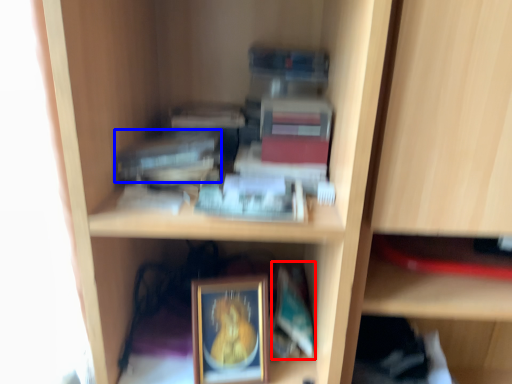
Question: Among these objects, which one is nearest to the camera, paperback book (highlighted by a red box) or paperback book (highlighted by a blue box)?

Choices:
 (A) paperback book
 (B) paperback book

Answer: (B)